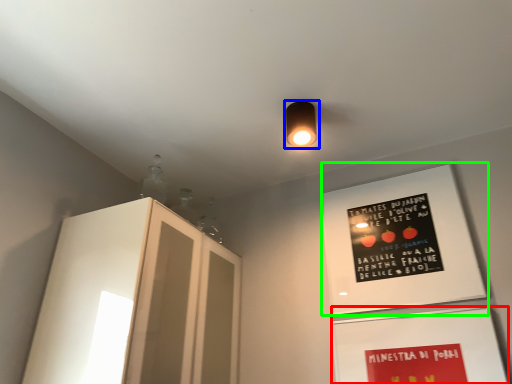
Question: Which is nearer to the bulletin board (highlighted by a red box)? lamp (highlighted by a blue box) or bulletin board (highlighted by a green box).

Choices:
 (A) lamp
 (B) bulletin board

Answer: (B)